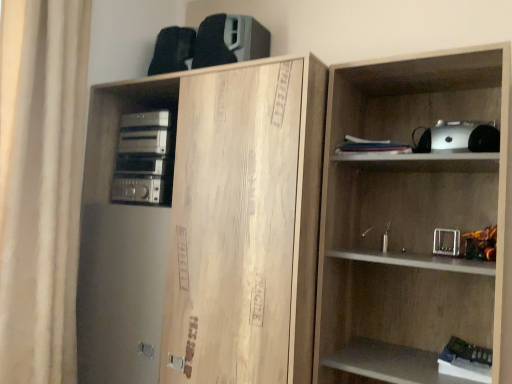
Question: Considering their positions, is silver metallic stereo at left located in front of or behind white fabric curtain at left?

Choices:
 (A) front
 (B) behind

Answer: (B)

Question: In terms of height, does silver metallic stereo at left look taller or shorter compared to white fabric curtain at left?

Choices:
 (A) short
 (B) tall

Answer: (A)

Question: Which object is positioned farthest from the white matte book at lower right, the 2th book from the left?

Choices:
 (A) wooden shelf at right
 (B) white paper stack at upper center, positioned as the second book in right-to-left order
 (C) natural wood cabinet at upper left
 (D) white fabric curtain at left
 (E) silver metallic stereo at left

Answer: (D)

Question: Which is farther from the white paper stack at upper center, the 2th book ordered from the bottom?

Choices:
 (A) natural wood cabinet at upper left
 (B) white matte book at lower right, the 2th book positioned from the top
 (C) silver metallic stereo at left
 (D) white fabric curtain at left
 (E) wooden shelf at right

Answer: (D)